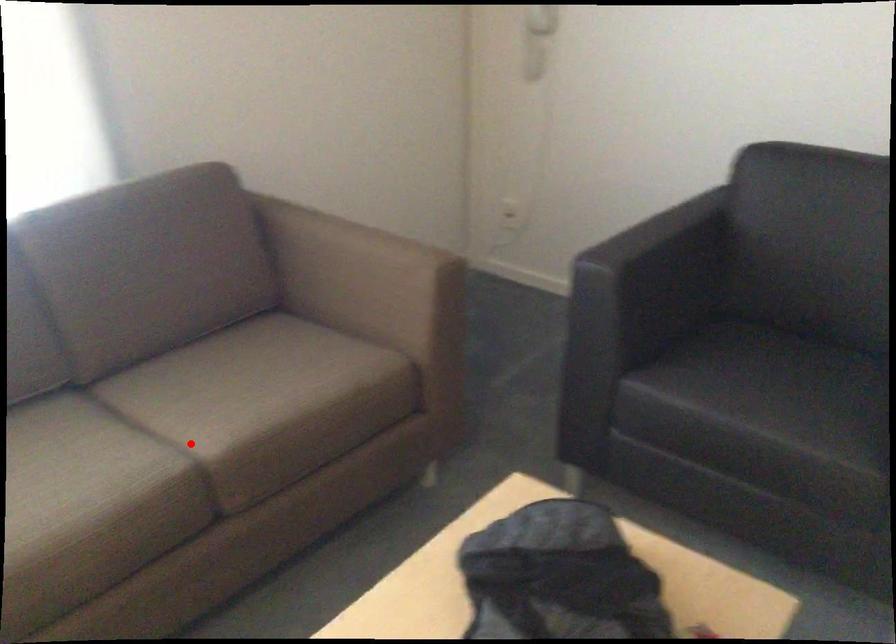
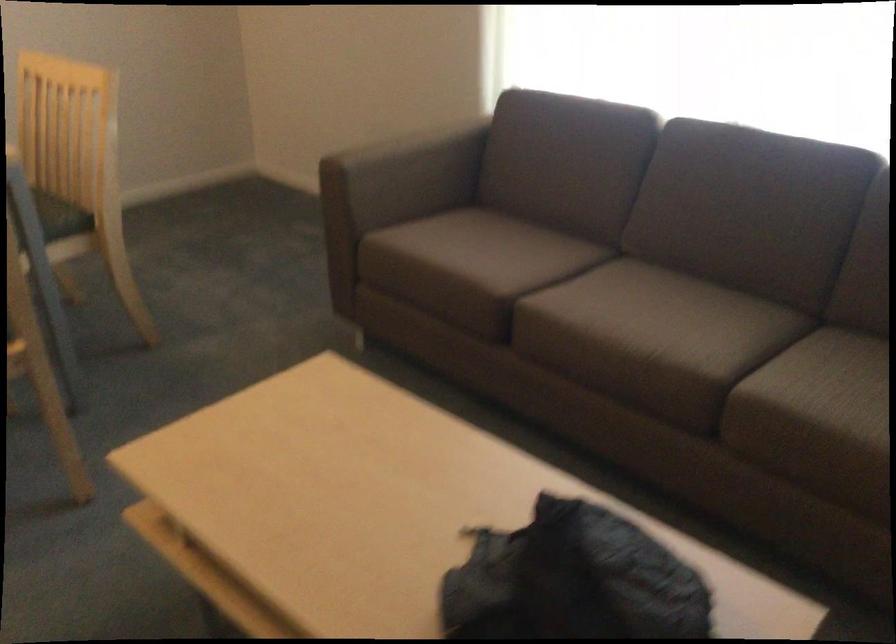
Where in the second image is the point corresponding to the highlighted location from the first image?

(726, 368)